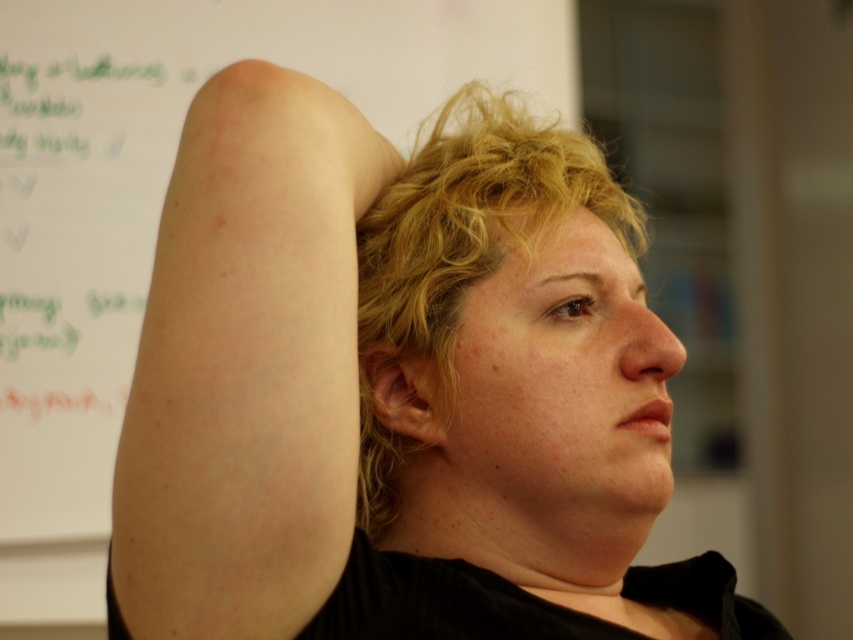
Question: Which is nearer to the blonde curly hair at center?

Choices:
 (A) white paper at upper left
 (B) pale skin at upper right
 (C) pale skin arm at upper left

Answer: (C)

Question: Can you confirm if pale skin at upper right is positioned above white paper at upper left?

Choices:
 (A) no
 (B) yes

Answer: (A)

Question: Estimate the real-world distances between objects in this image. Which object is farther from the blonde curly hair at center?

Choices:
 (A) pale skin arm at upper left
 (B) pale skin at upper right
 (C) white paper at upper left

Answer: (C)

Question: Is pale skin at upper right smaller than blonde curly hair at center?

Choices:
 (A) yes
 (B) no

Answer: (A)

Question: Is white paper at upper left above blonde curly hair at center?

Choices:
 (A) no
 (B) yes

Answer: (B)

Question: Which point is farther to the camera?

Choices:
 (A) (238, 628)
 (B) (431, 284)
 (C) (28, 225)

Answer: (C)